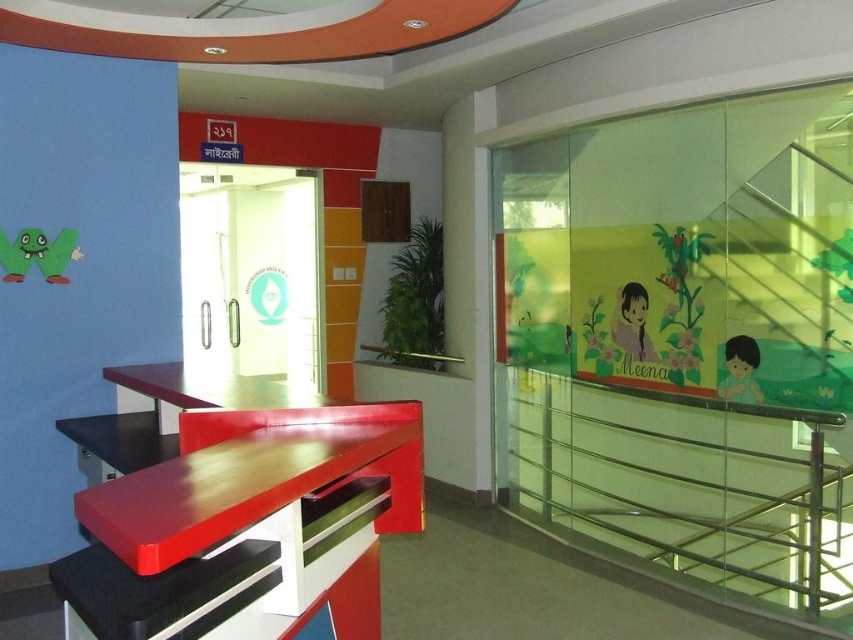
Question: Which object is the farthest from the pastel pink paper at upper right?

Choices:
 (A) clear glass balustrade at right
 (B) wooden table at center

Answer: (B)

Question: Which point is closer to the camera taking this photo?

Choices:
 (A) (222, 422)
 (B) (821, 468)

Answer: (A)

Question: Is clear glass balustrade at right smaller than pastel pink paper at upper right?

Choices:
 (A) no
 (B) yes

Answer: (A)

Question: Is clear glass balustrade at right bigger than matte yellow child at right?

Choices:
 (A) no
 (B) yes

Answer: (B)

Question: Which point is farther to the camera?

Choices:
 (A) (372, 580)
 (B) (747, 374)
 (C) (828, 452)
 (D) (643, 355)

Answer: (D)

Question: Does clear glass balustrade at right appear on the left side of pastel pink paper at upper right?

Choices:
 (A) no
 (B) yes

Answer: (A)